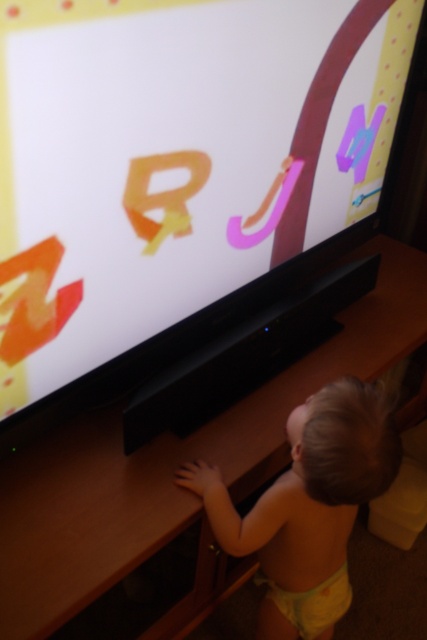
Who is lower down, blonde hair toddler at lower center or matte yellow letter r at upper center?

blonde hair toddler at lower center is below.

In the scene shown: Does blonde hair toddler at lower center appear on the left side of matte yellow letter r at upper center?

Incorrect, blonde hair toddler at lower center is not on the left side of matte yellow letter r at upper center.

What do you see at coordinates (307, 506) in the screenshot?
I see `blonde hair toddler at lower center` at bounding box center [307, 506].

Locate an element on the screen. blonde hair toddler at lower center is located at coordinates 307,506.

Which is more to the right, black plastic soundbar at center or purple matte letter m at upper right?

purple matte letter m at upper right

The image size is (427, 640). What do you see at coordinates (169, 461) in the screenshot?
I see `black plastic soundbar at center` at bounding box center [169, 461].

You are a GUI agent. You are given a task and a screenshot of the screen. Output one action in this format:
    pyautogui.click(x=<x>, y=<y>)
    Task: Click on the black plastic soundbar at center
    The image size is (427, 640).
    Given the screenshot: What is the action you would take?
    pyautogui.click(x=169, y=461)

Does point (228, 458) lie in front of point (248, 237)?

That is True.

Between black plastic soundbar at center and pink matte letter j at center, which one has less height?

pink matte letter j at center is shorter.

Which is behind, point (53, 620) or point (274, 216)?

Point (274, 216)

At what (x,y) coordinates should I click in order to perform the action: click on black plastic soundbar at center. Please return your answer as a coordinate pair (x, y). The image size is (427, 640). Looking at the image, I should click on (169, 461).